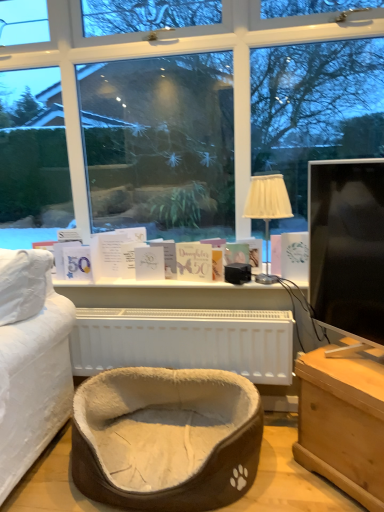
Question: From the image's perspective, is white paper card at center, positioned as the third book in right-to-left order, located above or below matte gold card at center, which ranks as the second book in right-to-left order?

Choices:
 (A) below
 (B) above

Answer: (A)

Question: Looking at the image, does white paper card at center, the first book viewed from the left, seem bigger or smaller compared to matte gold card at center, placed as the second book when sorted from left to right?

Choices:
 (A) small
 (B) big

Answer: (A)

Question: Which object is positioned farthest from the matte gold card at center, which ranks as the second book in right-to-left order?

Choices:
 (A) beige fabric lampshade at center
 (B) white paper book at right, the 1th book from the right
 (C) light brown wooden chest at lower right
 (D) white plastic radiator at center
 (E) black glossy monitor at right

Answer: (C)

Question: Which of these objects is positioned farthest from the beige fabric lampshade at center?

Choices:
 (A) white plastic radiator at center
 (B) white paper book at right, arranged as the 3th book when viewed from the left
 (C) matte gold card at center, which ranks as the second book in right-to-left order
 (D) white paper card at center, the first book viewed from the left
 (E) light brown wooden chest at lower right

Answer: (E)